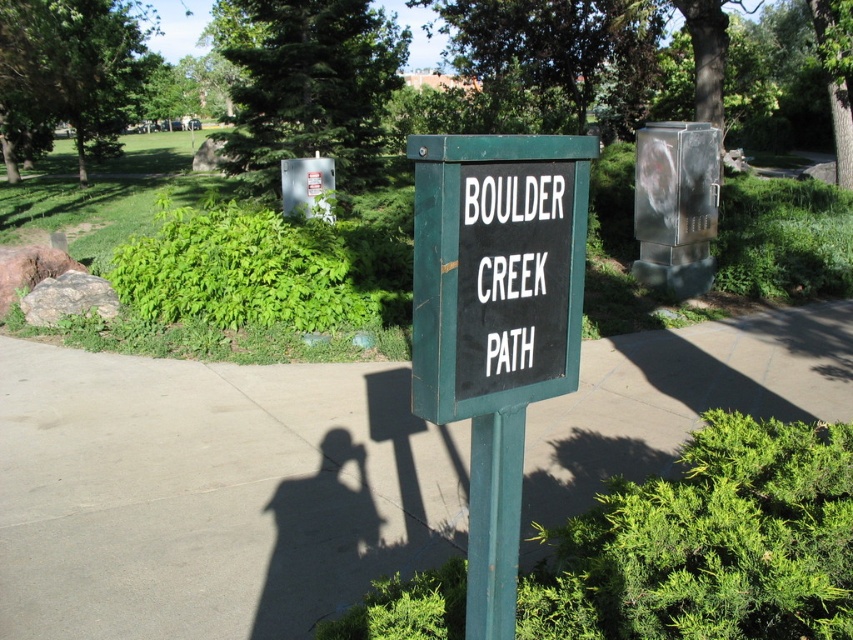
Question: Estimate the real-world distances between objects in this image. Which object is closer to the green matte sign at center?

Choices:
 (A) gray concrete pavement at center
 (B) green painted metal pole at center

Answer: (B)

Question: In this image, where is gray concrete pavement at center located relative to black plastic sign at center?

Choices:
 (A) right
 (B) left

Answer: (B)

Question: Does gray concrete pavement at center appear over green matte sign at center?

Choices:
 (A) no
 (B) yes

Answer: (A)

Question: Does gray concrete pavement at center have a greater width compared to black plastic sign at center?

Choices:
 (A) no
 (B) yes

Answer: (B)

Question: Based on their relative distances, which object is farther from the gray concrete pavement at center?

Choices:
 (A) green painted metal pole at center
 (B) green matte sign at center

Answer: (B)

Question: Which point is farther to the camera?

Choices:
 (A) (485, 244)
 (B) (811, 369)
 (C) (492, 451)
 (D) (503, 332)

Answer: (B)